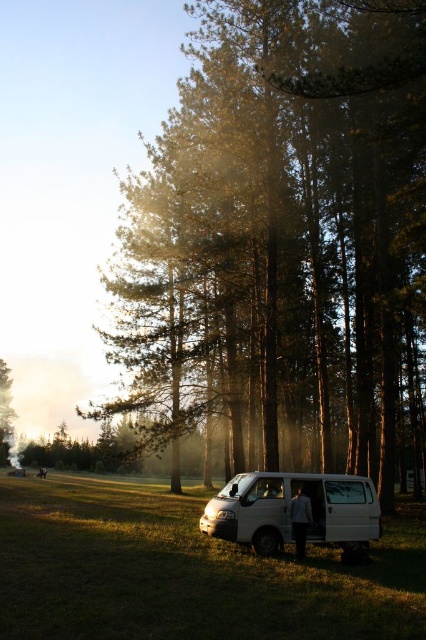
Question: Is green textured pine trees at center smaller than white matte van at center?

Choices:
 (A) no
 (B) yes

Answer: (A)

Question: Is green textured pine trees at center to the right of white matte van at center from the viewer's perspective?

Choices:
 (A) yes
 (B) no

Answer: (B)

Question: From the image, what is the correct spatial relationship of green textured pine trees at center in relation to white matte van at center?

Choices:
 (A) right
 (B) left

Answer: (B)

Question: Which point is closer to the camera taking this photo?

Choices:
 (A) (391, 499)
 (B) (226, 506)

Answer: (B)